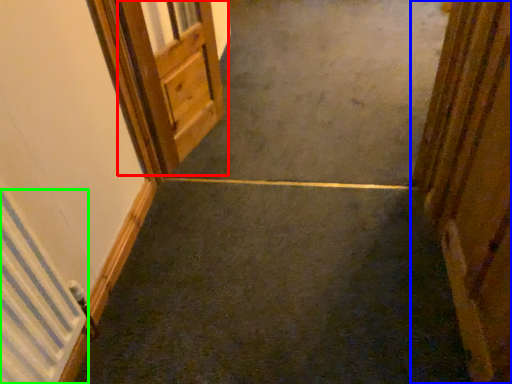
Question: Considering the real-world distances, which object is farthest from door (highlighted by a red box)? door (highlighted by a blue box) or radiator (highlighted by a green box)?

Choices:
 (A) door
 (B) radiator

Answer: (A)